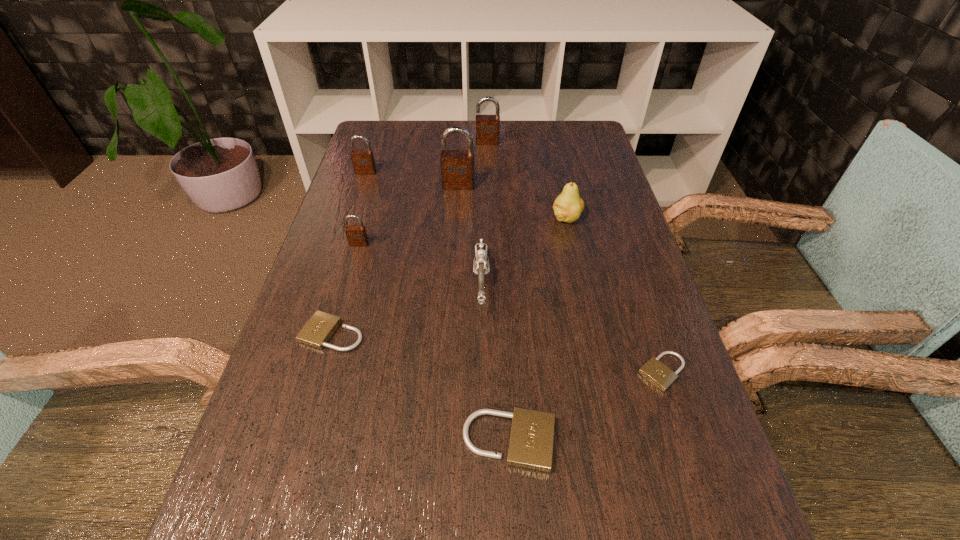
Where is `the second brown padlock from right to left`? This screenshot has height=540, width=960. the second brown padlock from right to left is located at coordinates (457, 166).

The image size is (960, 540). Identify the location of the tallest object. pos(457,166).

This screenshot has height=540, width=960. Identify the location of the farthest padlock. (487, 126).

Where is `the second biggest brown padlock`? the second biggest brown padlock is located at coordinates (487, 126).

Identify the location of the eighth object from left to right. Image resolution: width=960 pixels, height=540 pixels. (568, 206).

Where is `the fourth farthest object`? This screenshot has height=540, width=960. the fourth farthest object is located at coordinates (568, 206).

Find the location of a particular element. the fifth shortest padlock is located at coordinates (363, 161).

Locate an element on the screen. The height and width of the screenshot is (540, 960). the third biggest brown padlock is located at coordinates (363, 161).

Find the location of a particular element. This screenshot has width=960, height=540. the fourth farthest padlock is located at coordinates (356, 235).

This screenshot has width=960, height=540. What are the coordinates of `the fourth tallest padlock` in the screenshot? It's located at (356, 235).